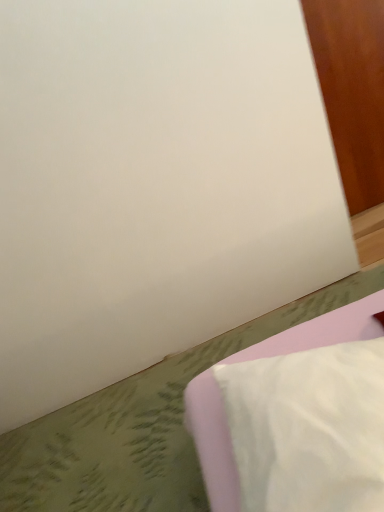
Question: Should I look upward or downward to see white fabric pillow at lower right?

Choices:
 (A) up
 (B) down

Answer: (B)